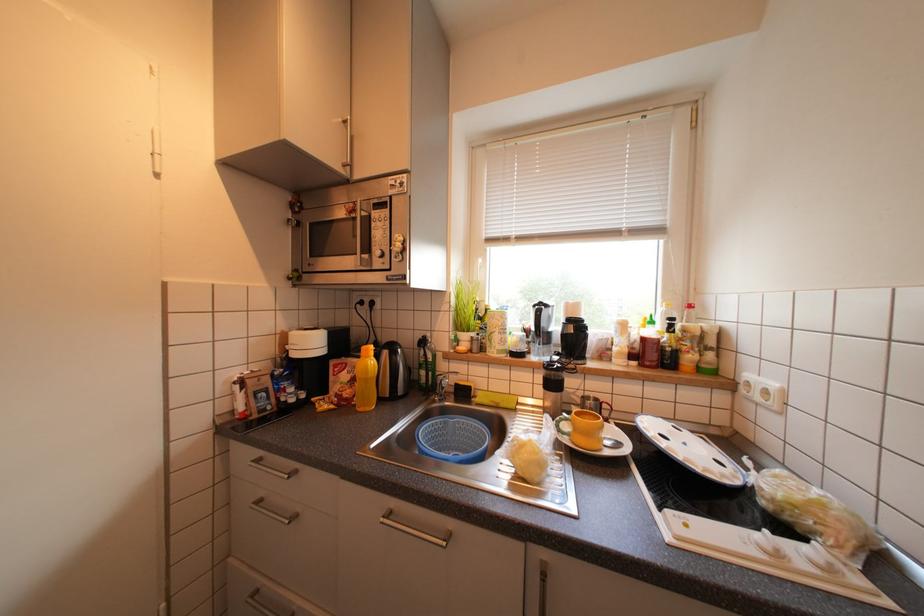
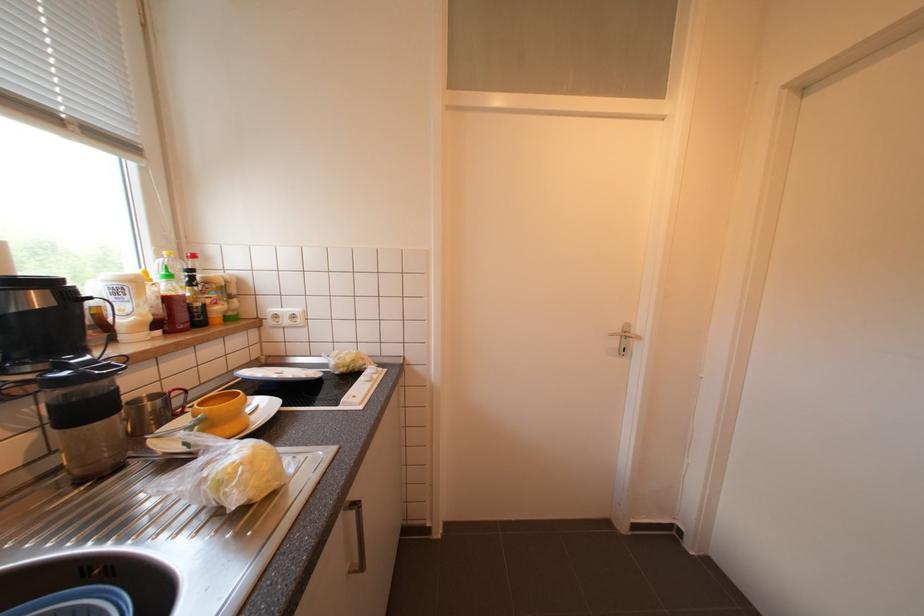
Question: The camera is either moving clockwise (left) or counter-clockwise (right) around the object. The first image is from the beginning of the video and the second image is from the end. Is the camera moving left or right when shooting the video?

Choices:
 (A) Left
 (B) Right

Answer: (A)